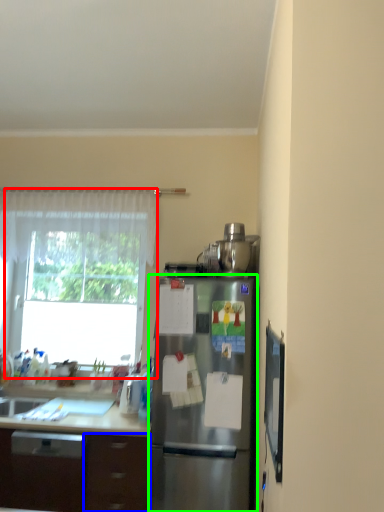
Question: Which is nearer to the window (highlighted by a red box)? drawer (highlighted by a blue box) or refrigerator (highlighted by a green box).

Choices:
 (A) drawer
 (B) refrigerator

Answer: (A)